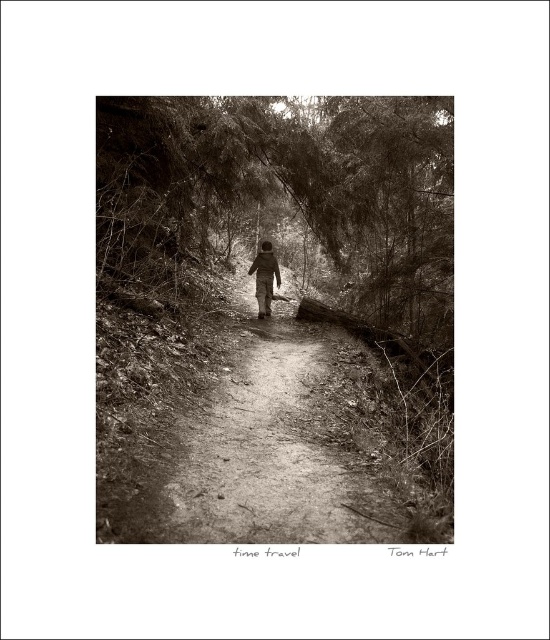
Which is more to the right, sepia textured forest at center or matte black jacket at center?

sepia textured forest at center is more to the right.

Identify the location of sepia textured forest at center. The image size is (550, 640). (277, 320).